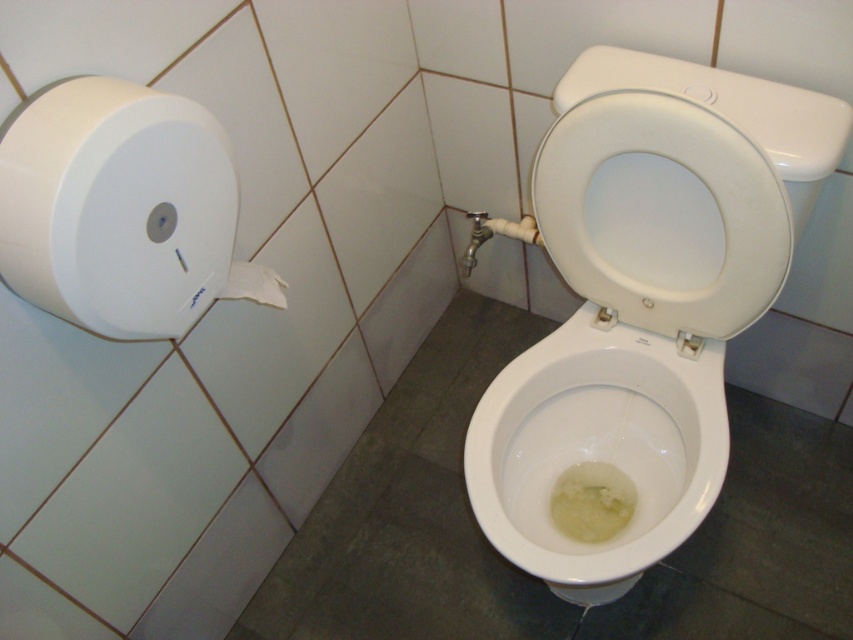
You are a plumber checking the bathroom for potential blockages. You notice two white toilet paper rolls, the white plastic toilet paper at left and the white matte toilet paper at upper left. Which one is more likely to cause a blockage if flushed?

The white plastic toilet paper at left is more likely to cause a blockage if flushed because plastic materials are not biodegradable and do not break down easily in water, unlike the white matte toilet paper at upper left which is likely regular toilet paper designed to dissolve.

You are a maintenance worker inspecting a bathroom. You see the white plastic toilet paper at left and the white matte toilet paper at upper left. Which one is bigger in size?

The white plastic toilet paper at left is larger in size than the white matte toilet paper at upper left.